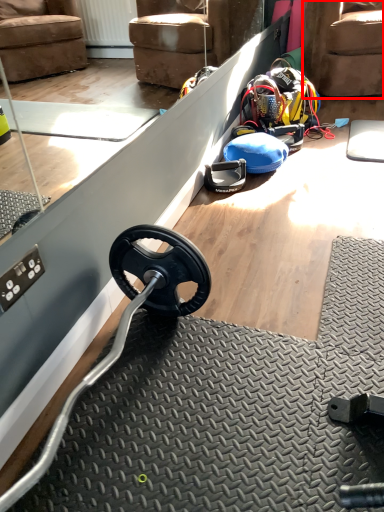
Question: From the image's perspective, what is the correct spatial relationship of armchair (annotated by the red box) in relation to wheel?

Choices:
 (A) below
 (B) above

Answer: (B)